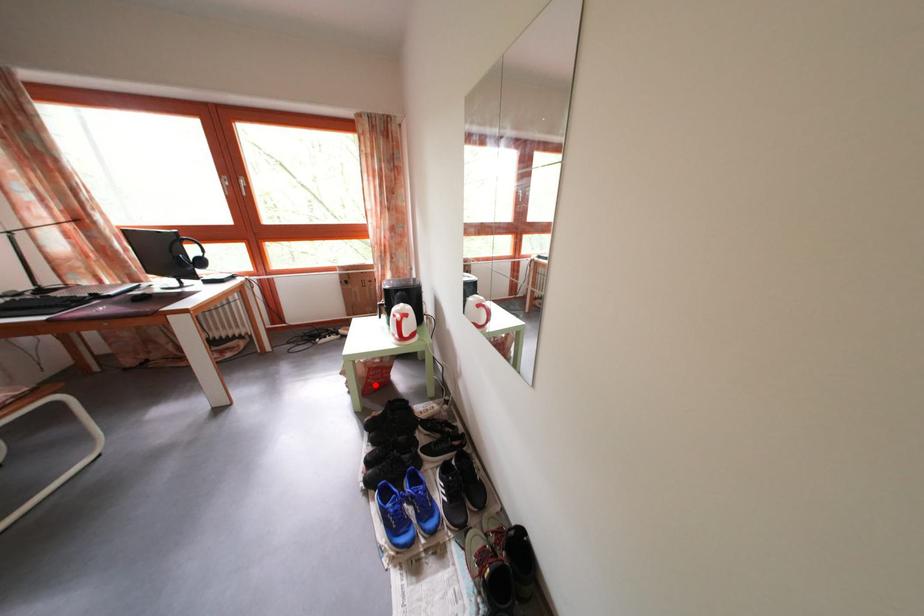
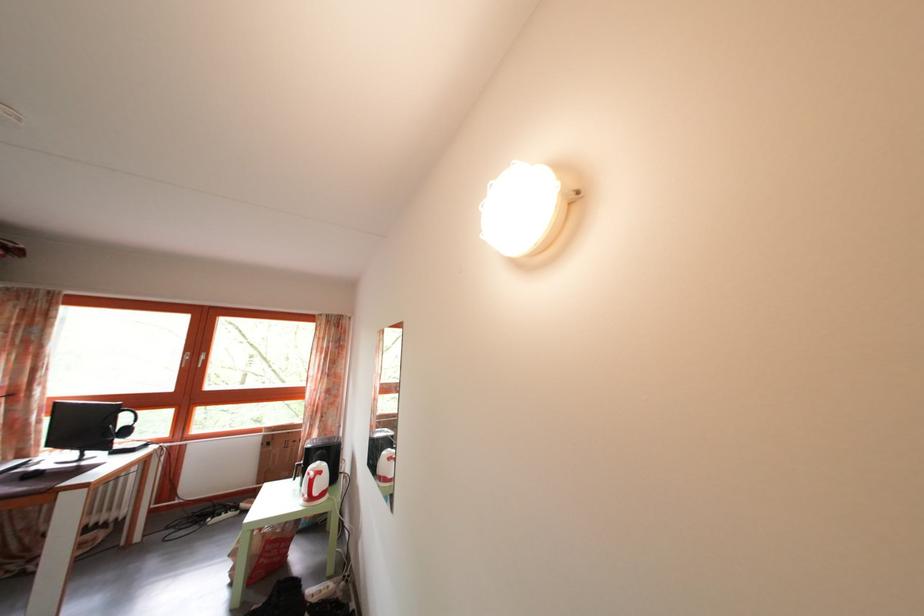
Where in the second image is the point corresponding to the highlighted location from the first image?

(268, 562)